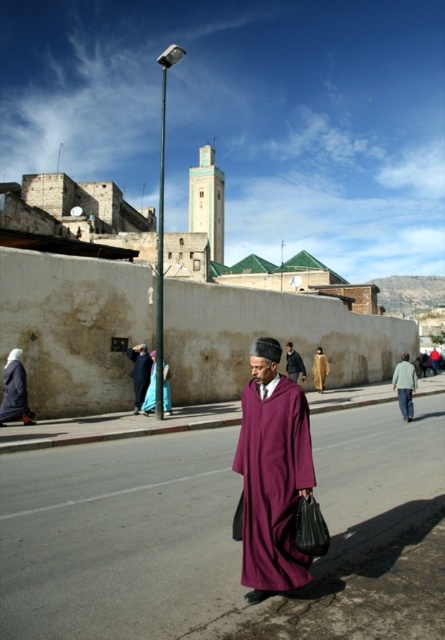
You are a tailor in the city and need to determine which fabric piece is wider to decide which one to use for a large coat. You have the light gray fabric jacket at lower right and the purple fabric at center. Which fabric has a greater width?

The light gray fabric jacket at lower right has a greater width than the purple fabric at center according to the description.

You are a photographer trying to capture both the dark purple fabric at center and the blue silk dress at center in a single frame. Based on their sizes, which object should you focus on first to ensure both are in the frame?

The dark purple fabric at center might be wider than the blue silk dress at center, so focusing on the wider dark purple fabric at center first would help ensure both are in the frame.